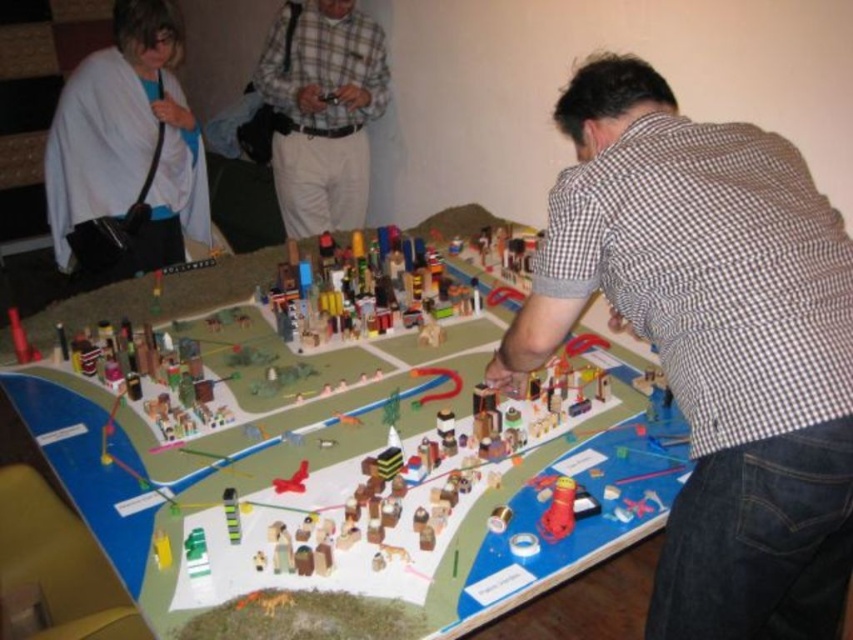
Question: Can you confirm if brown checkered shirt at center is positioned below plaid fabric shirt at center?

Choices:
 (A) no
 (B) yes

Answer: (B)

Question: Which point is farther to the camera?

Choices:
 (A) plaid fabric shirt at center
 (B) white fabric at upper left
 (C) brown checkered shirt at center
 (D) wooden cityscape at center

Answer: (A)

Question: Does wooden cityscape at center have a lesser width compared to brown checkered shirt at center?

Choices:
 (A) no
 (B) yes

Answer: (A)

Question: Which object is closer to the camera taking this photo?

Choices:
 (A) wooden cityscape at center
 (B) brown checkered shirt at center
 (C) plaid fabric shirt at center
 (D) white fabric at upper left

Answer: (B)

Question: Which point is closer to the camera?

Choices:
 (A) (320, 616)
 (B) (279, 124)

Answer: (A)

Question: From the image, what is the correct spatial relationship of wooden cityscape at center in relation to white fabric at upper left?

Choices:
 (A) above
 (B) below

Answer: (B)